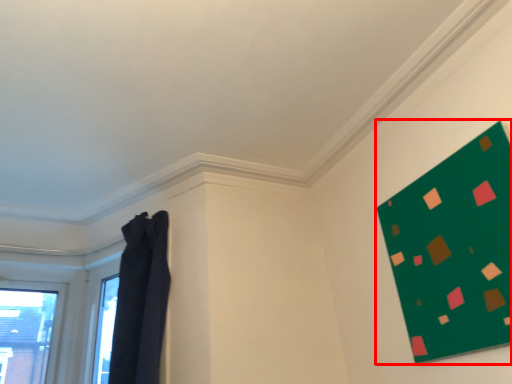
Question: From the image's perspective, considering the relative positions of bulletin board (annotated by the red box) and curtain in the image provided, where is bulletin board (annotated by the red box) located with respect to the staircase?

Choices:
 (A) below
 (B) above

Answer: (B)